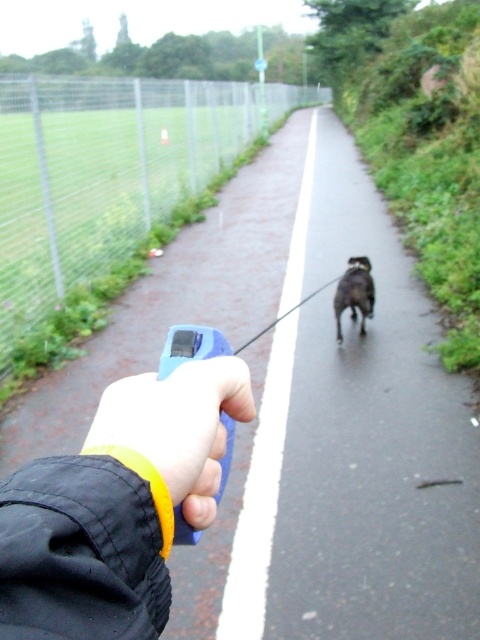
Question: Which of the following is the closest to the observer?

Choices:
 (A) metal fence at left
 (B) yellow rubber wristband at lower center
 (C) black fabric wristband at lower left

Answer: (C)

Question: Considering the relative positions of yellow rubber wristband at lower center and shiny black dog at center in the image provided, where is yellow rubber wristband at lower center located with respect to shiny black dog at center?

Choices:
 (A) above
 (B) below

Answer: (B)

Question: Is metal fence at left positioned at the back of shiny black dog at center?

Choices:
 (A) no
 (B) yes

Answer: (A)

Question: Which point is closer to the camera?

Choices:
 (A) (365, 284)
 (B) (188, 481)
 (C) (147, 195)

Answer: (B)

Question: Which is nearer to the black fabric wristband at lower left?

Choices:
 (A) black rubber leash at center
 (B) shiny black dog at center
 (C) metal fence at left
 (D) yellow rubber wristband at lower center

Answer: (D)

Question: Can you confirm if black rubber leash at center is positioned below shiny black dog at center?

Choices:
 (A) no
 (B) yes

Answer: (A)